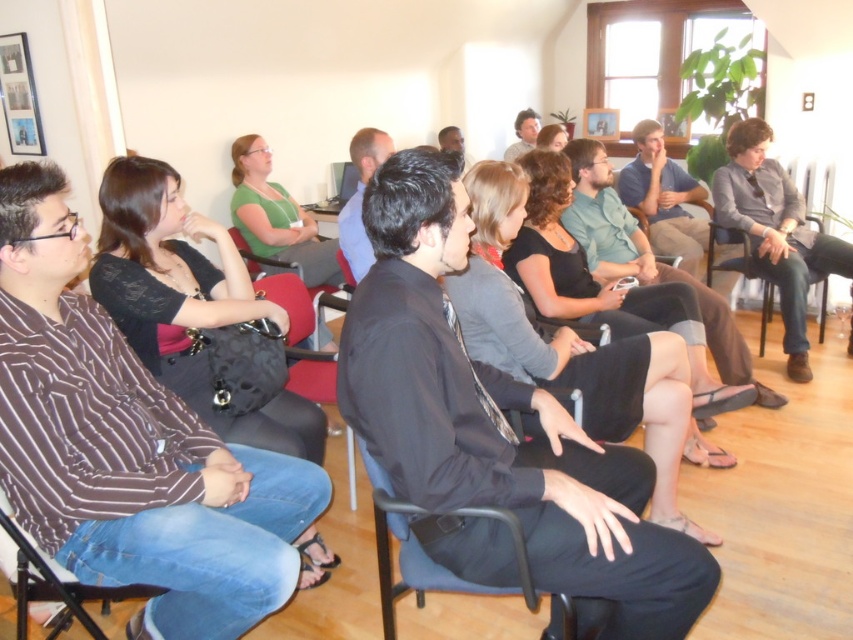
Question: Estimate the real-world distances between objects in this image. Which object is farther from the black fabric chair at center?

Choices:
 (A) gray cotton shirt at right
 (B) striped fabric chair at lower left
 (C) black fabric chair at right

Answer: (A)

Question: Considering the real-world distances, which object is closest to the striped fabric chair at lower left?

Choices:
 (A) black fabric chair at right
 (B) gray cotton shirt at right

Answer: (A)

Question: Among these points, which one is nearest to the camera?

Choices:
 (A) (737, 136)
 (B) (107, 609)
 (C) (434, 566)
 (D) (724, 268)

Answer: (C)

Question: Observing the image, what is the correct spatial positioning of black fabric chair at center in reference to striped fabric chair at lower left?

Choices:
 (A) below
 (B) above

Answer: (B)

Question: Is gray cotton shirt at right smaller than black fabric chair at center?

Choices:
 (A) yes
 (B) no

Answer: (B)

Question: Is the position of gray cotton shirt at right less distant than that of striped fabric chair at lower left?

Choices:
 (A) yes
 (B) no

Answer: (B)